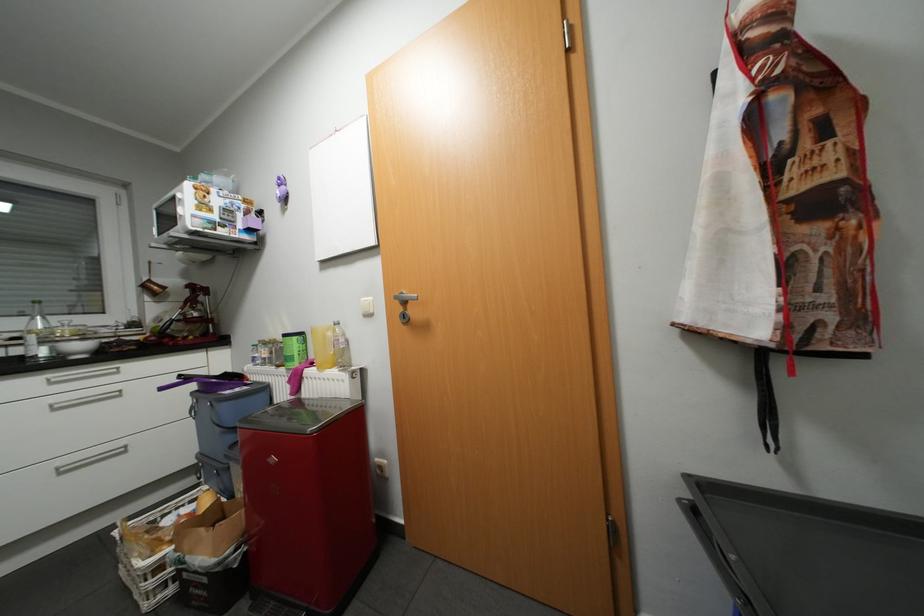
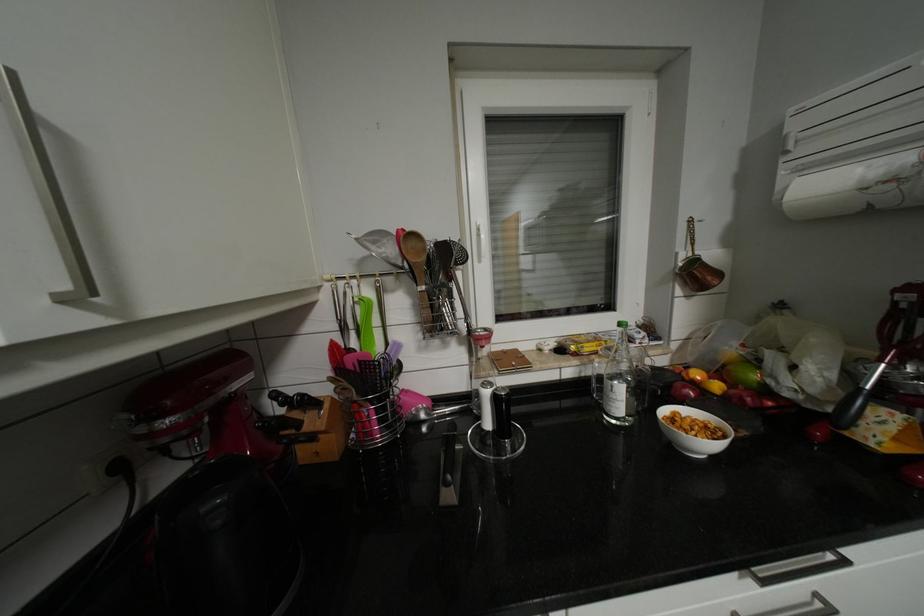
The point at (157,281) is marked in the first image. Where is the corresponding point in the second image?

(702, 261)